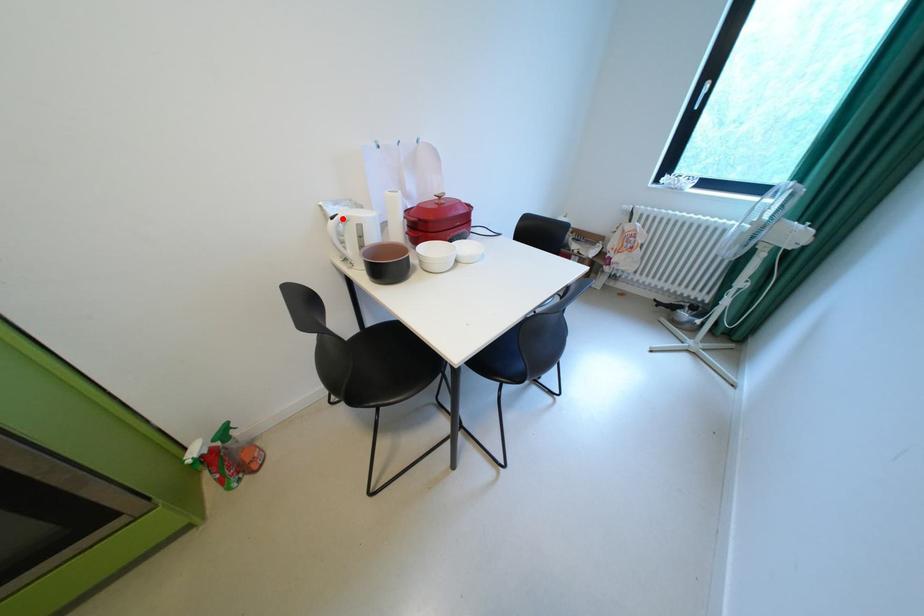
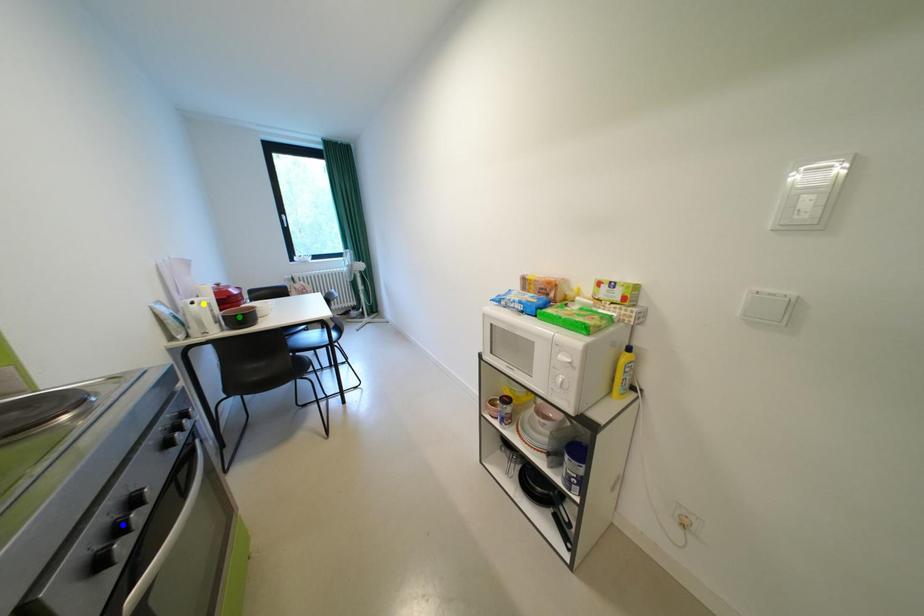
Question: I am providing you with two images of the same scene from different viewpoints. A red point is marked on the first image. You are given multiple points on the second image. Which mark in image 2 goes with the point in image 1?

Choices:
 (A) blue point
 (B) green point
 (C) yellow point

Answer: (C)